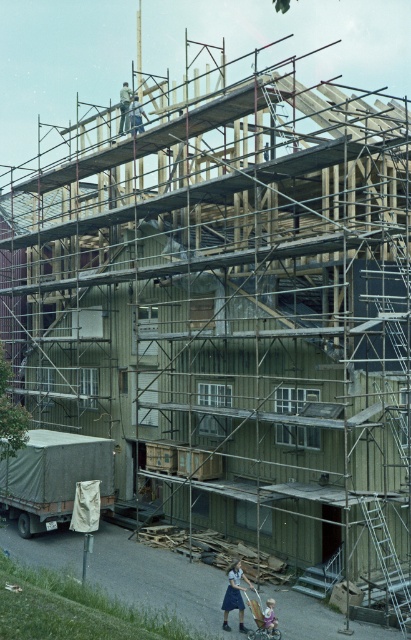
Question: Is camouflage fabric baby carriage at lower left wider than wooden baby carriage at lower center?

Choices:
 (A) no
 (B) yes

Answer: (B)

Question: Does metallic silver ladder at lower right have a larger size compared to wooden baby carriage at lower center?

Choices:
 (A) yes
 (B) no

Answer: (A)

Question: Is wooden construction worker at center bigger than wooden baby carriage at lower center?

Choices:
 (A) yes
 (B) no

Answer: (A)

Question: Which point is farther from the camera taking this photo?

Choices:
 (A) (258, 627)
 (B) (62, 474)

Answer: (B)

Question: Considering the real-world distances, which object is farthest from the wooden construction worker at center?

Choices:
 (A) camouflage fabric baby carriage at lower left
 (B) wooden baby carriage at lower center

Answer: (A)

Question: Which object is positioned closest to the wooden construction worker at center?

Choices:
 (A) metallic silver ladder at lower right
 (B) camouflage fabric baby carriage at lower left
 (C) wooden baby carriage at lower center

Answer: (C)